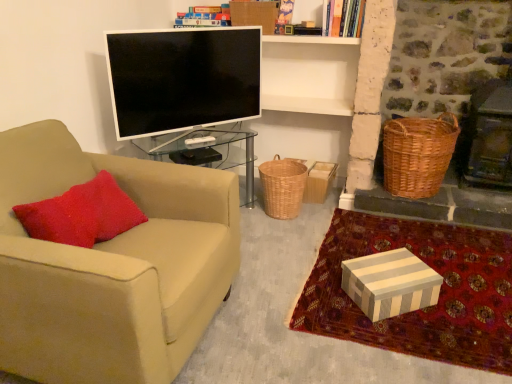
Question: Is woven brown picnic basket at right aimed at flat screen tv at center?

Choices:
 (A) no
 (B) yes

Answer: (A)

Question: Is flat screen tv at center located within woven brown picnic basket at right?

Choices:
 (A) yes
 (B) no

Answer: (B)

Question: From a real-world perspective, does woven brown picnic basket at right sit lower than flat screen tv at center?

Choices:
 (A) yes
 (B) no

Answer: (A)

Question: Does woven brown picnic basket at right have a lesser width compared to flat screen tv at center?

Choices:
 (A) yes
 (B) no

Answer: (B)

Question: Can you confirm if woven brown picnic basket at right is bigger than flat screen tv at center?

Choices:
 (A) no
 (B) yes

Answer: (B)

Question: Does woven brown picnic basket at right come behind flat screen tv at center?

Choices:
 (A) yes
 (B) no

Answer: (A)

Question: Is striped cardboard box at lower right looking in the opposite direction of hardcover book at upper center?

Choices:
 (A) yes
 (B) no

Answer: (B)

Question: Is striped cardboard box at lower right at the left side of hardcover book at upper center?

Choices:
 (A) no
 (B) yes

Answer: (A)

Question: From the image's perspective, is striped cardboard box at lower right beneath hardcover book at upper center?

Choices:
 (A) no
 (B) yes

Answer: (B)

Question: Is striped cardboard box at lower right shorter than hardcover book at upper center?

Choices:
 (A) yes
 (B) no

Answer: (A)

Question: Is striped cardboard box at lower right facing towards hardcover book at upper center?

Choices:
 (A) no
 (B) yes

Answer: (A)

Question: Does striped cardboard box at lower right have a smaller size compared to hardcover book at upper center?

Choices:
 (A) yes
 (B) no

Answer: (B)

Question: Considering the relative sizes of beige fabric chair at left and woven brown picnic basket at right in the image provided, is beige fabric chair at left thinner than woven brown picnic basket at right?

Choices:
 (A) no
 (B) yes

Answer: (A)